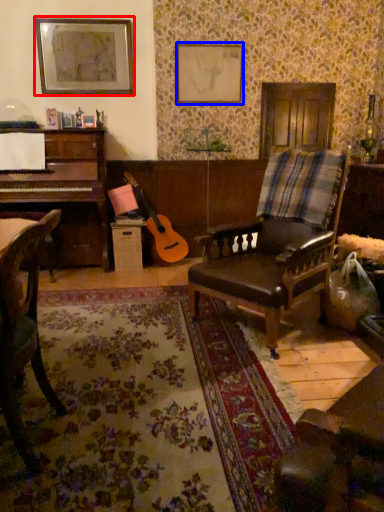
Question: Which object appears closest to the camera in this image, picture frame (highlighted by a red box) or picture frame (highlighted by a blue box)?

Choices:
 (A) picture frame
 (B) picture frame

Answer: (A)